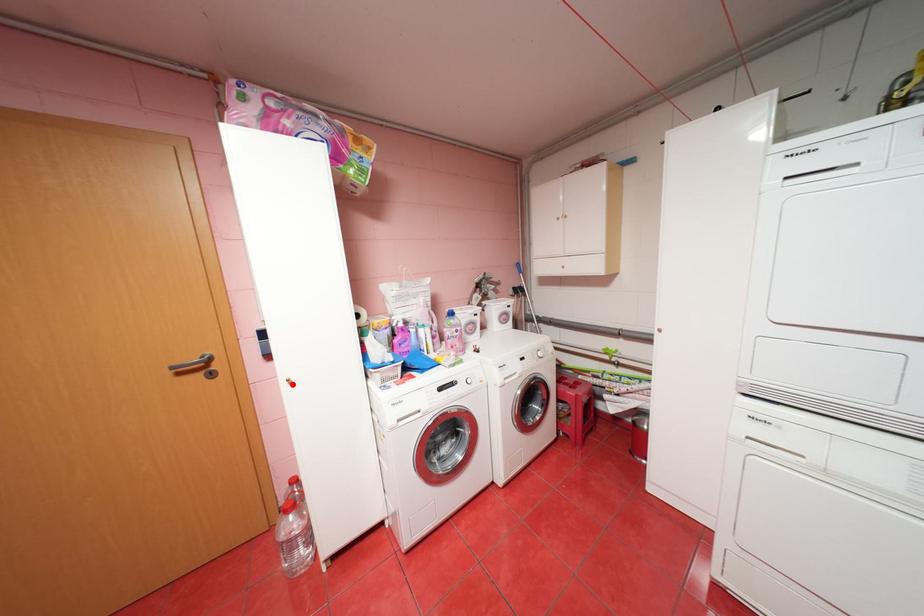
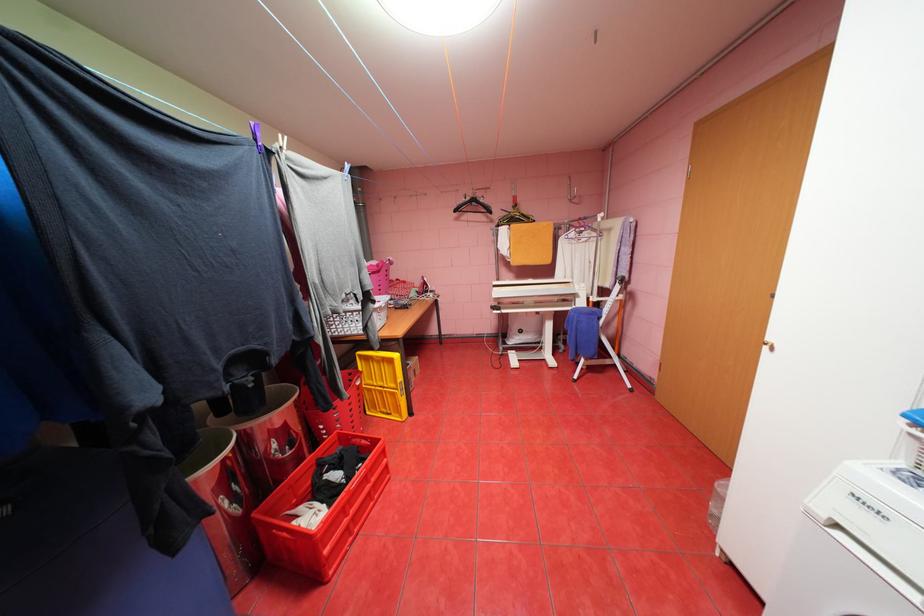
Locate, in the second image, the point that corresponds to the highlighted location in the first image.

(774, 347)